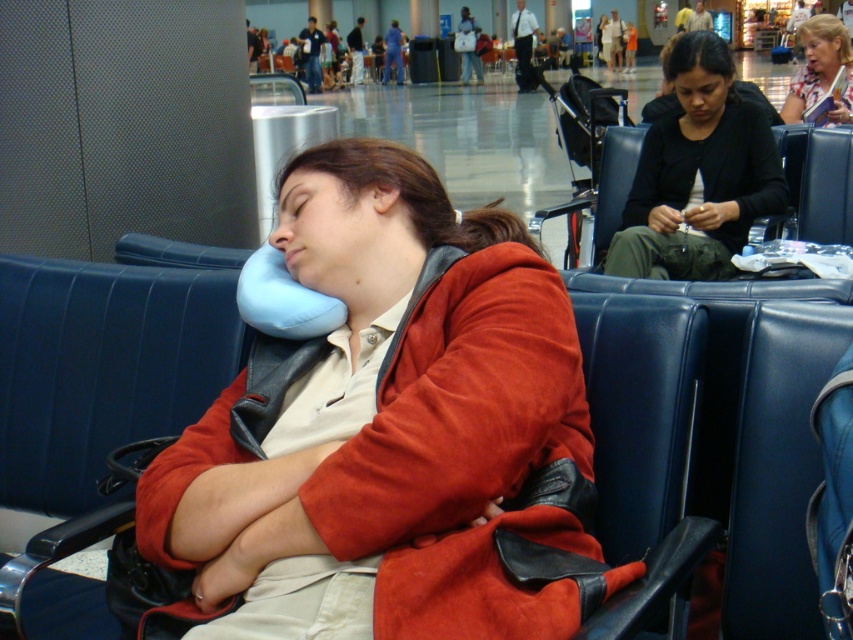
Question: Can you confirm if matte blue neck pillow at center is thinner than matte black jacket at center?

Choices:
 (A) no
 (B) yes

Answer: (A)

Question: Which point is farther from the camera taking this photo?

Choices:
 (A) (839, 40)
 (B) (231, 552)
 (C) (663, 140)

Answer: (A)

Question: Which of the following is the farthest from the observer?

Choices:
 (A) (749, 204)
 (B) (553, 410)

Answer: (A)

Question: Does matte blue neck pillow at center have a lesser width compared to matte black jacket at center?

Choices:
 (A) yes
 (B) no

Answer: (B)

Question: Which of these objects is positioned closest to the black matte jacket at center?

Choices:
 (A) matte blue neck pillow at center
 (B) matte black jacket at center

Answer: (B)

Question: Is black matte jacket at center smaller than matte black jacket at center?

Choices:
 (A) no
 (B) yes

Answer: (A)